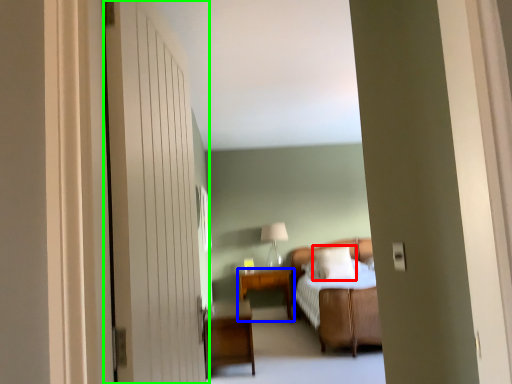
Question: Which object is the farthest from pillow (highlighted by a red box)? Choose among these: table (highlighted by a blue box) or door (highlighted by a green box).

Choices:
 (A) table
 (B) door

Answer: (B)